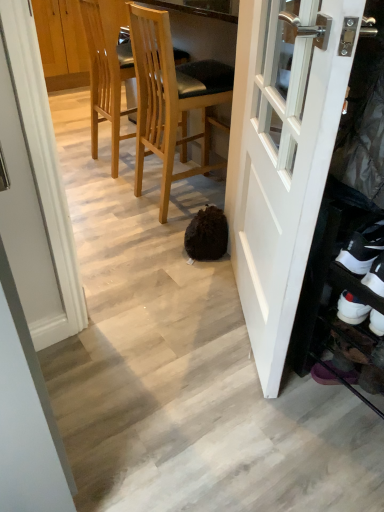
The height and width of the screenshot is (512, 384). I want to click on free spot to the left of light brown wood chair at center, which is counted as the 1th chair, starting from the right, so click(110, 198).